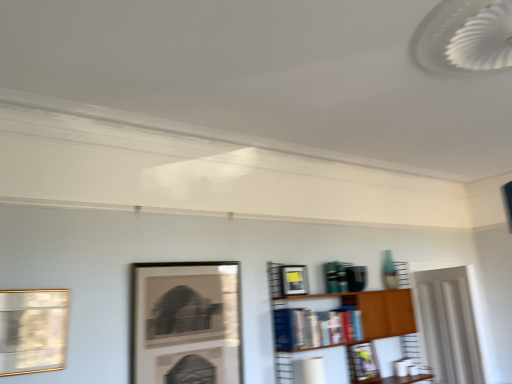
Question: Is matte black picture frame at center, which appears as the second picture frame when viewed from the left, not inside gold-framed picture at left, positioned as the first picture frame in left-to-right order?

Choices:
 (A) no
 (B) yes

Answer: (B)

Question: Is matte black picture frame at center, the third picture frame positioned from the right, taller than gold-framed picture at left, which is the 4th picture frame from right to left?

Choices:
 (A) yes
 (B) no

Answer: (A)

Question: From a real-world perspective, is matte black picture frame at center, which appears as the third picture frame when viewed from the back, on gold-framed picture at left, the first picture frame viewed from the front?

Choices:
 (A) no
 (B) yes

Answer: (A)

Question: Is the position of matte black picture frame at center, the third picture frame positioned from the right, less distant than that of gold-framed picture at left, the first picture frame viewed from the front?

Choices:
 (A) no
 (B) yes

Answer: (A)

Question: Is matte black picture frame at center, which appears as the second picture frame when viewed from the left, positioned far away from gold-framed picture at left, positioned as the first picture frame in left-to-right order?

Choices:
 (A) yes
 (B) no

Answer: (B)

Question: Is matte black picture frame at center, which appears as the 2th picture frame when viewed from the front, to the right of gold-framed picture at left, which ranks as the fourth picture frame in back-to-front order, from the viewer's perspective?

Choices:
 (A) yes
 (B) no

Answer: (A)

Question: Is wooden bookshelf at center-right far from matte black picture frame at upper center, which appears as the fourth picture frame when viewed from the front?

Choices:
 (A) yes
 (B) no

Answer: (B)

Question: Can you confirm if wooden bookshelf at center-right is positioned to the left of matte black picture frame at upper center, which appears as the fourth picture frame when viewed from the front?

Choices:
 (A) no
 (B) yes

Answer: (B)

Question: Does wooden bookshelf at center-right lie in front of matte black picture frame at upper center, which is the fourth picture frame in left-to-right order?

Choices:
 (A) no
 (B) yes

Answer: (B)

Question: From a real-world perspective, is wooden bookshelf at center-right under matte black picture frame at upper center, which appears as the fourth picture frame when viewed from the front?

Choices:
 (A) yes
 (B) no

Answer: (B)

Question: Does wooden bookshelf at center-right appear on the right side of matte black picture frame at upper center, which appears as the fourth picture frame when viewed from the front?

Choices:
 (A) no
 (B) yes

Answer: (A)

Question: Is wooden bookshelf at center-right smaller than matte black picture frame at upper center, placed as the first picture frame when sorted from back to front?

Choices:
 (A) yes
 (B) no

Answer: (B)

Question: Does matte black picture frame at upper center, placed as the first picture frame when sorted from back to front, appear on the right side of matte black picture frame at center, which appears as the third picture frame when viewed from the back?

Choices:
 (A) yes
 (B) no

Answer: (A)